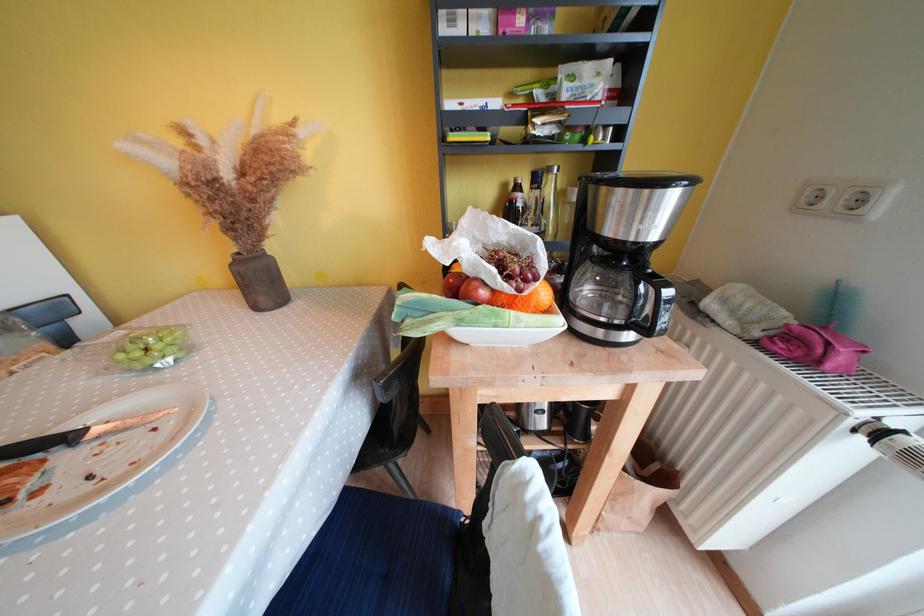
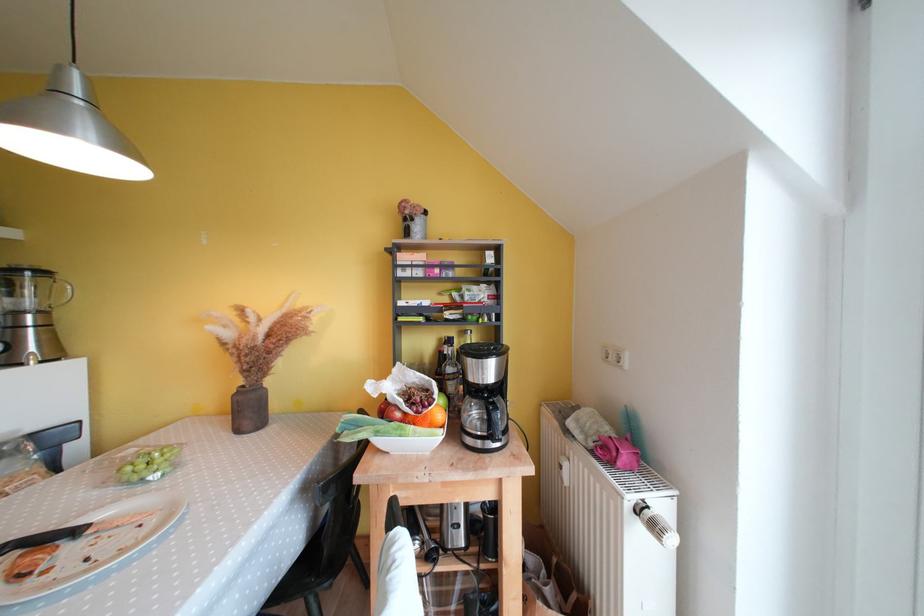
Question: I am providing you with two images of the same scene from different viewpoints. Please identify which objects are invisible in image2.

Choices:
 (A) coffee maker lid
 (B) coffee pot handle
 (C) black handled knife
 (D) none of these

Answer: (D)